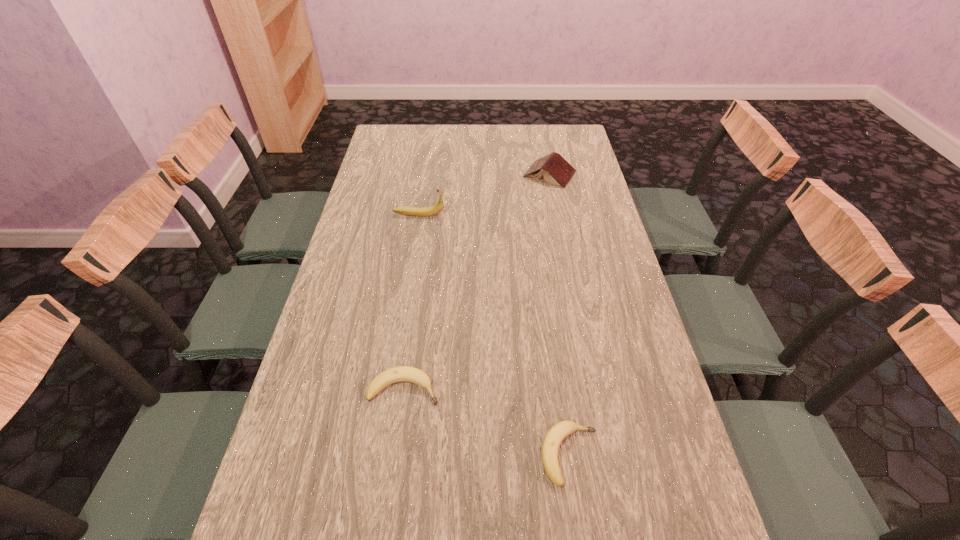
I want to click on vacant space situated 0.150m on the right of the nearest object, so click(x=669, y=455).

The image size is (960, 540). What are the coordinates of `object that is at the left edge` in the screenshot? It's located at (438, 207).

The height and width of the screenshot is (540, 960). Find the location of `object that is at the right edge`. object that is at the right edge is located at coordinates (555, 169).

Identify the location of free location at the far edge. (476, 136).

Where is `vacant space at the left edge of the desktop`? The width and height of the screenshot is (960, 540). vacant space at the left edge of the desktop is located at coordinates (381, 261).

The width and height of the screenshot is (960, 540). In the image, there is a desktop. Find the location of `vacant region at the right edge`. vacant region at the right edge is located at coordinates (652, 408).

Image resolution: width=960 pixels, height=540 pixels. In the image, there is a desktop. What are the coordinates of `free space at the far left corner` in the screenshot? It's located at (410, 127).

You are a GUI agent. You are given a task and a screenshot of the screen. Output one action in this format:
    pyautogui.click(x=<x>, y=<y>)
    Task: Click on the empty space that is in between the tallest banana and the nearest object
    
    Given the screenshot: What is the action you would take?
    pyautogui.click(x=494, y=335)

In order to click on vacant point located between the second nearest object and the third nearest object in this screenshot , I will do `click(412, 301)`.

At what (x,y) coordinates should I click in order to perform the action: click on empty space between the farthest banana and the rightmost banana. Please return your answer as a coordinate pair (x, y). Looking at the image, I should click on (494, 335).